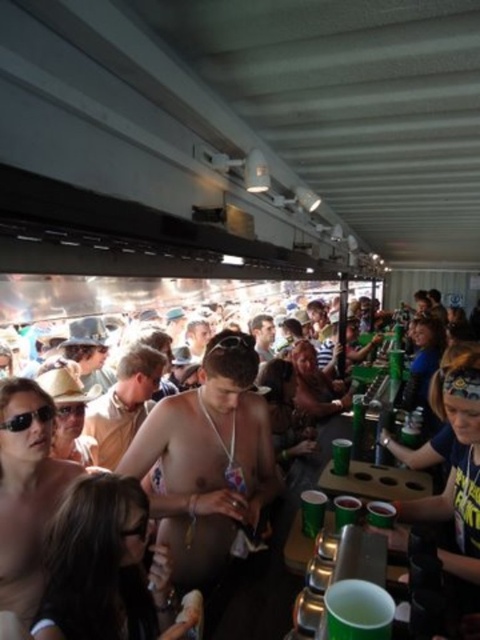
Between nude skin at center and green plastic cup at lower center, which one is positioned lower?

green plastic cup at lower center

Is nude skin at center to the right of green plastic cup at lower center from the viewer's perspective?

Incorrect, nude skin at center is not on the right side of green plastic cup at lower center.

Locate an element on the screen. This screenshot has width=480, height=640. nude skin at center is located at coordinates (196, 448).

Where is `nude skin at center`? This screenshot has height=640, width=480. nude skin at center is located at coordinates (196, 448).

Does green plastic cup at lower center appear over black plastic sunglasses at center?

No.

Does green plastic cup at lower center have a lesser width compared to black plastic sunglasses at center?

In fact, green plastic cup at lower center might be wider than black plastic sunglasses at center.

This screenshot has height=640, width=480. Find the location of `green plastic cup at lower center`. green plastic cup at lower center is located at coordinates [358, 611].

You are a GUI agent. You are given a task and a screenshot of the screen. Output one action in this format:
    pyautogui.click(x=<x>, y=<y>)
    Task: Click on the green plastic cup at lower center
    
    Given the screenshot: What is the action you would take?
    pyautogui.click(x=358, y=611)

Between nude skin at center and black plastic sunglasses at center, which one appears on the left side from the viewer's perspective?

Positioned to the left is black plastic sunglasses at center.

Can you confirm if nude skin at center is shorter than black plastic sunglasses at center?

No, nude skin at center is not shorter than black plastic sunglasses at center.

Locate an element on the screen. The height and width of the screenshot is (640, 480). nude skin at center is located at coordinates (196, 448).

Identify the location of nude skin at center. (196, 448).